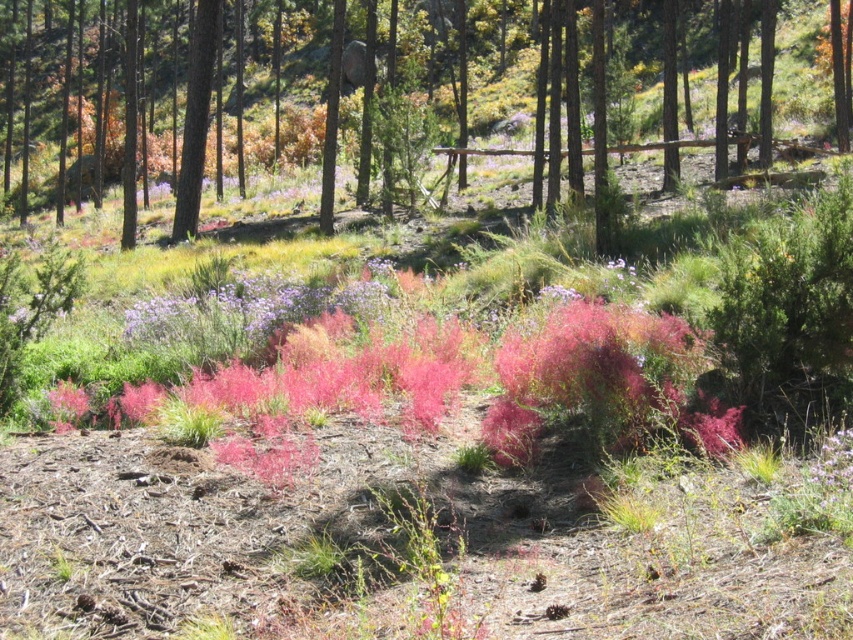
Question: Which point is farther from the camera taking this photo?

Choices:
 (A) (148, 396)
 (B) (206, 8)

Answer: (B)

Question: Which object appears closest to the camera in this image?

Choices:
 (A) pink fluffy plant at center
 (B) green matte tree at center
 (C) smooth bark tree at center

Answer: (A)

Question: Is the position of smooth bark tree at center less distant than that of pink fluffy plant at center?

Choices:
 (A) no
 (B) yes

Answer: (A)

Question: Which point is farther to the camera?

Choices:
 (A) (193, 141)
 (B) (195, 163)

Answer: (B)

Question: Is the position of pink fluffy plant at center less distant than that of green matte tree at center?

Choices:
 (A) no
 (B) yes

Answer: (B)

Question: From the image, what is the correct spatial relationship of smooth bark tree at center in relation to pink fluffy plant at center?

Choices:
 (A) above
 (B) below

Answer: (A)